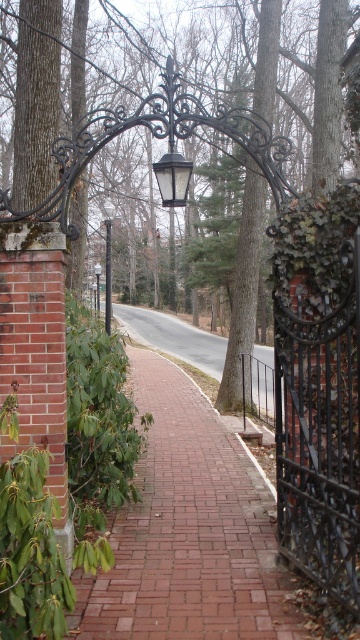
Is black wrought iron lamp at center to the right of satin silver pole at center from the viewer's perspective?

Indeed, black wrought iron lamp at center is positioned on the right side of satin silver pole at center.

Can you confirm if black wrought iron lamp at center is taller than satin silver pole at center?

In fact, black wrought iron lamp at center may be shorter than satin silver pole at center.

Is point (173, 177) farther from camera compared to point (99, 292)?

No.

At what (x,y) coordinates should I click in order to perform the action: click on black wrought iron lamp at center. Please return your answer as a coordinate pair (x, y). This screenshot has height=640, width=360. Looking at the image, I should click on (172, 156).

Is brick at center below black wrought iron gate at center right?

Indeed, brick at center is positioned under black wrought iron gate at center right.

Is point (272, 636) positioned behind point (347, 374)?

No, it is in front of (347, 374).

The height and width of the screenshot is (640, 360). I want to click on brick at center, so click(x=189, y=531).

Does brick at center appear on the right side of black wrought iron lamp at center?

Correct, you'll find brick at center to the right of black wrought iron lamp at center.

Who is taller, brick at center or black wrought iron lamp at center?

Standing taller between the two is black wrought iron lamp at center.

Identify the location of brick at center. 189,531.

The height and width of the screenshot is (640, 360). I want to click on brick at center, so click(189, 531).